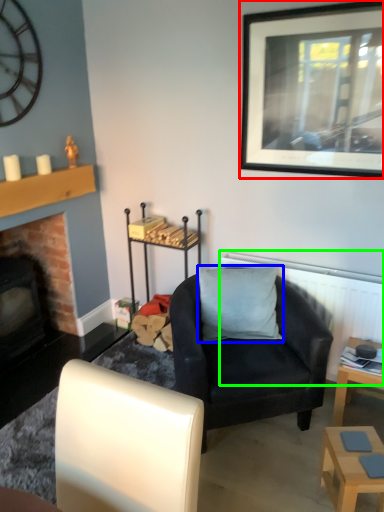
Question: Which object is positioned farthest from picture frame (highlighted by a red box)? Select from pillow (highlighted by a blue box) and radiator (highlighted by a green box).

Choices:
 (A) pillow
 (B) radiator

Answer: (A)